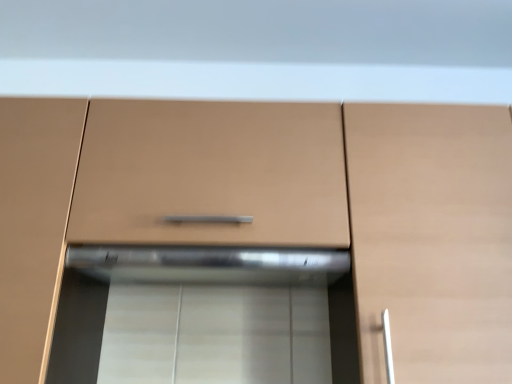
Question: Is matte brown drawer at center situated inside matte wood cabinet at center, the 2th cabinetry viewed from the right, or outside?

Choices:
 (A) inside
 (B) outside

Answer: (B)

Question: From a real-world perspective, relative to matte wood cabinet at center, which is the first cabinetry in left-to-right order, is matte brown drawer at center vertically above or below?

Choices:
 (A) below
 (B) above

Answer: (B)

Question: Based on their relative distances, which object is nearer to the matte wood cabinet at right, which is the first cabinetry in right-to-left order?

Choices:
 (A) matte brown drawer at center
 (B) matte wood cabinet at center, which is the first cabinetry in left-to-right order

Answer: (A)

Question: Which of these objects is positioned farthest from the matte wood cabinet at center, which is the first cabinetry in left-to-right order?

Choices:
 (A) matte brown drawer at center
 (B) matte wood cabinet at right, the second cabinetry from the left

Answer: (B)